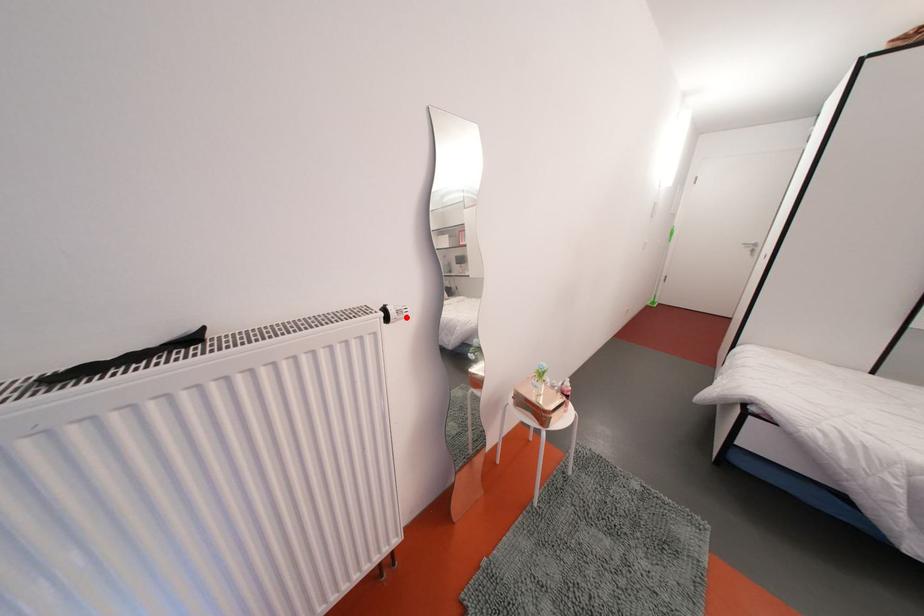
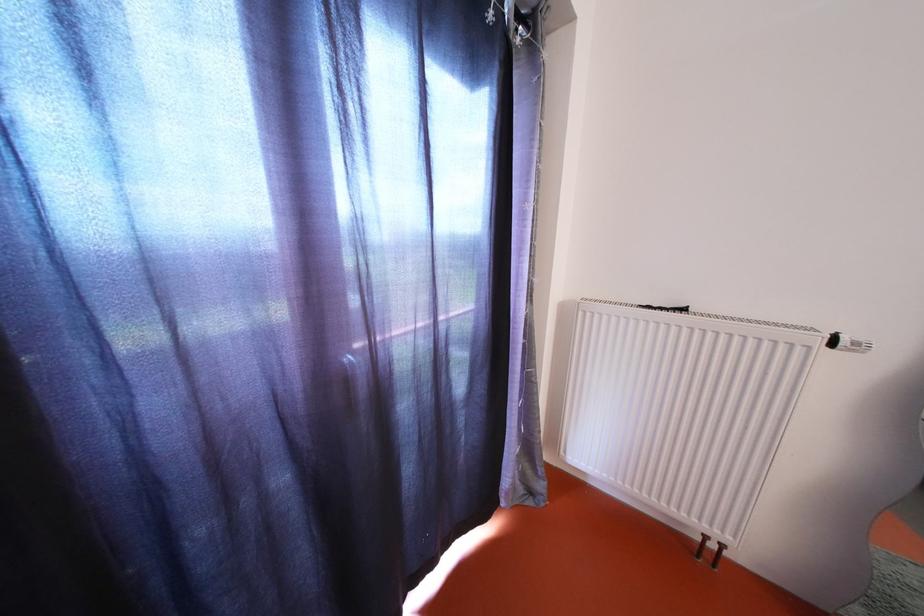
Question: A red point is marked in image1. In image2, is the corresponding 3D point closer to the camera or farther? Reply with the corresponding letter.

Choices:
 (A) The corresponding 3D point is closer.
 (B) The corresponding 3D point is farther.

Answer: (A)